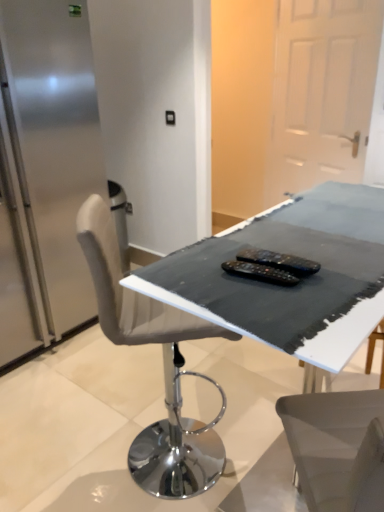
Locate an element on the screen. This screenshot has height=512, width=384. unoccupied region to the right of black plastic remote controls at center, the second equipment ordered from the bottom is located at coordinates (340, 260).